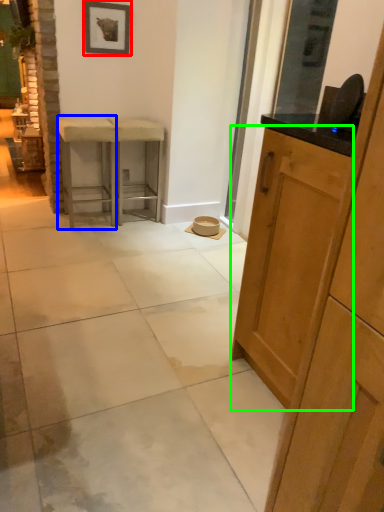
Question: Which object is the closest to the picture frame (highlighted by a red box)? Choose among these: stool (highlighted by a blue box) or cabinetry (highlighted by a green box).

Choices:
 (A) stool
 (B) cabinetry

Answer: (A)